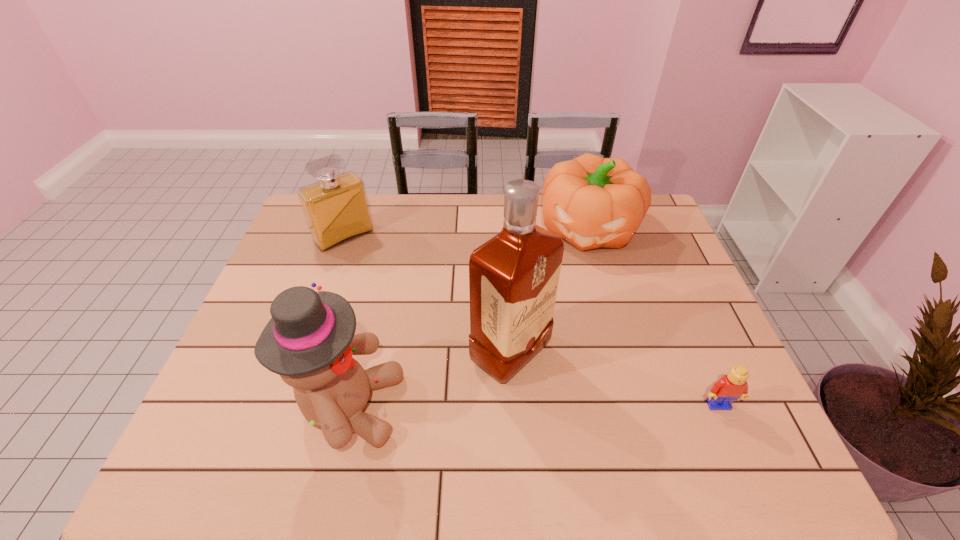
The image size is (960, 540). In the image, there is a desktop. What are the coordinates of `free region at the near right corner` in the screenshot? It's located at (684, 407).

Where is `free space that is in between the pumpkin and the perfume`? This screenshot has height=540, width=960. free space that is in between the pumpkin and the perfume is located at coordinates (467, 232).

Identify the location of unoccupied position between the pumpkin and the perfume. The image size is (960, 540). (467, 232).

Identify the location of vacant space that's between the fourth shortest object and the pumpkin. The image size is (960, 540). (469, 317).

This screenshot has height=540, width=960. What are the coordinates of `free space between the pumpkin and the perfume` in the screenshot? It's located at (467, 232).

Locate an element on the screen. The height and width of the screenshot is (540, 960). vacant area that lies between the Lego and the fourth shortest object is located at coordinates (534, 406).

You are a GUI agent. You are given a task and a screenshot of the screen. Output one action in this format:
    pyautogui.click(x=<x>, y=<y>)
    Task: Click on the object that ranks as the second closest to the pumpkin
    
    Given the screenshot: What is the action you would take?
    pyautogui.click(x=730, y=387)

You are a GUI agent. You are given a task and a screenshot of the screen. Output one action in this format:
    pyautogui.click(x=<x>, y=<y>)
    Task: Click on the closest object relative to the perfume
    
    Given the screenshot: What is the action you would take?
    (x=309, y=341)